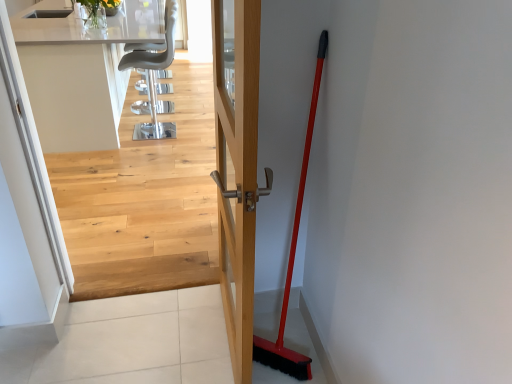
At what (x,y) coordinates should I click in order to perform the action: click on vacant region to the left of wooden door handle at center. Please return your answer as a coordinate pair (x, y). Image resolution: width=512 pixels, height=384 pixels. Looking at the image, I should click on (153, 337).